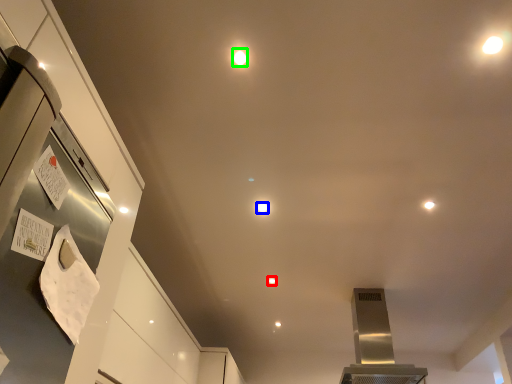
Question: Which object is positioned farthest from light (highlighted by a red box)? Select from light (highlighted by a blue box) and light (highlighted by a green box).

Choices:
 (A) light
 (B) light

Answer: (B)